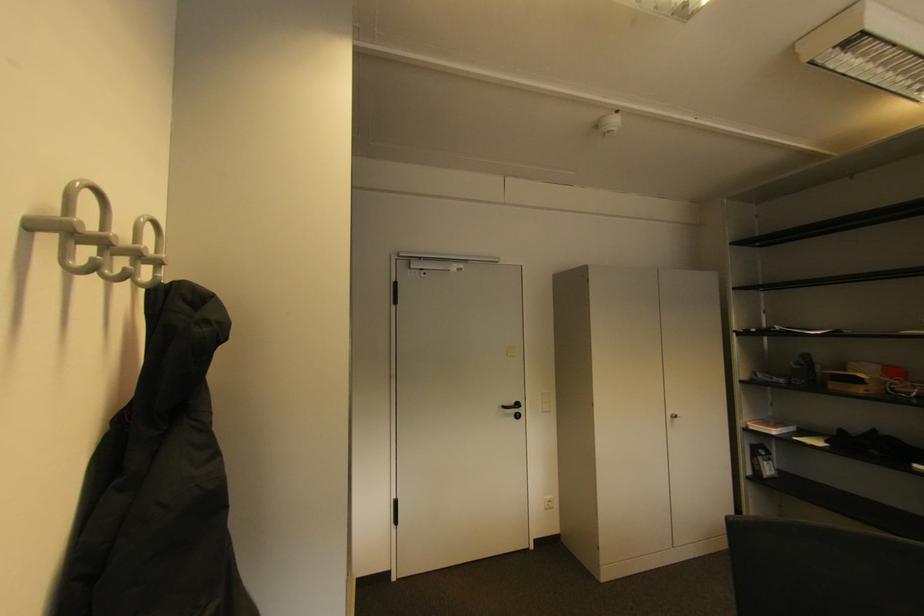
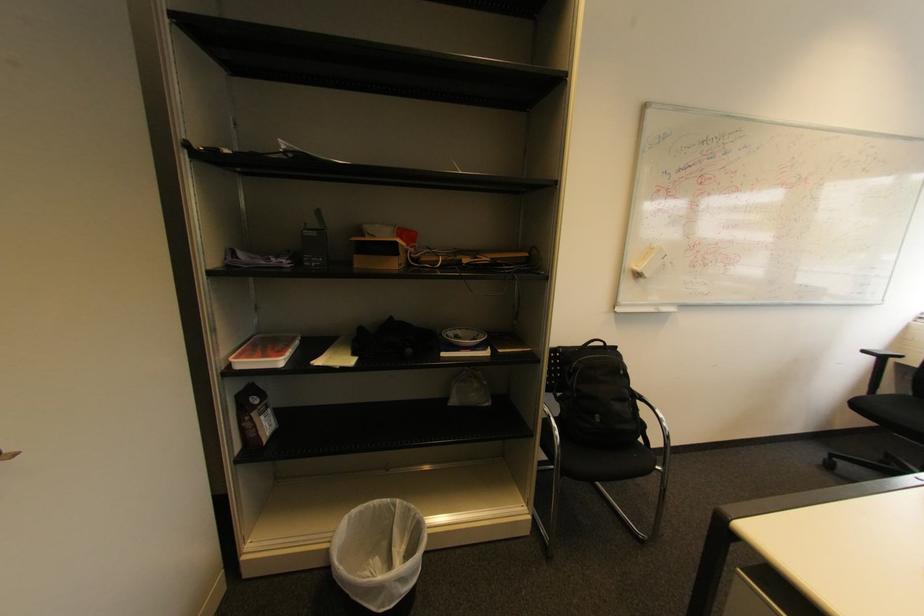
The point at (862, 381) is marked in the first image. Where is the corresponding point in the second image?

(395, 251)